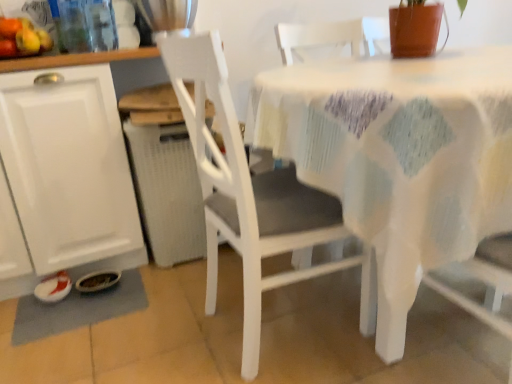
Question: Is the position of gray fabric place mat at lower left less distant than that of white matte cabinet at left?

Choices:
 (A) yes
 (B) no

Answer: (B)

Question: From a real-world perspective, is gray fabric place mat at lower left under white matte cabinet at left?

Choices:
 (A) yes
 (B) no

Answer: (A)

Question: Can you confirm if gray fabric place mat at lower left is wider than white matte cabinet at left?

Choices:
 (A) no
 (B) yes

Answer: (A)

Question: Is gray fabric place mat at lower left not close to white matte cabinet at left?

Choices:
 (A) no
 (B) yes

Answer: (A)

Question: Considering the relative positions of gray fabric place mat at lower left and white matte cabinet at left in the image provided, is gray fabric place mat at lower left to the left of white matte cabinet at left from the viewer's perspective?

Choices:
 (A) no
 (B) yes

Answer: (A)

Question: Is point (13, 21) closer or farther from the camera than point (370, 221)?

Choices:
 (A) farther
 (B) closer

Answer: (A)

Question: Considering the relative positions of shiny plastic fruits at upper left and white fabric-covered table at center in the image provided, is shiny plastic fruits at upper left to the left or to the right of white fabric-covered table at center?

Choices:
 (A) left
 (B) right

Answer: (A)

Question: Do you think shiny plastic fruits at upper left is within white fabric-covered table at center, or outside of it?

Choices:
 (A) inside
 (B) outside

Answer: (B)

Question: Considering the positions of shiny plastic fruits at upper left and white fabric-covered table at center in the image, is shiny plastic fruits at upper left bigger or smaller than white fabric-covered table at center?

Choices:
 (A) big
 (B) small

Answer: (B)

Question: From a real-world perspective, is white matte chair at center positioned above or below shiny plastic fruits at upper left?

Choices:
 (A) below
 (B) above

Answer: (A)

Question: Do you think white matte chair at center is within shiny plastic fruits at upper left, or outside of it?

Choices:
 (A) inside
 (B) outside

Answer: (B)

Question: Would you say white matte chair at center is to the left or to the right of shiny plastic fruits at upper left in the picture?

Choices:
 (A) right
 (B) left

Answer: (A)

Question: In terms of width, does white matte chair at center look wider or thinner when compared to shiny plastic fruits at upper left?

Choices:
 (A) wide
 (B) thin

Answer: (A)

Question: Considering the positions of point (338, 157) and point (137, 288), is point (338, 157) closer or farther from the camera than point (137, 288)?

Choices:
 (A) farther
 (B) closer

Answer: (B)

Question: From a real-world perspective, relative to gray fabric place mat at lower left, is white fabric-covered table at center vertically above or below?

Choices:
 (A) above
 (B) below

Answer: (A)